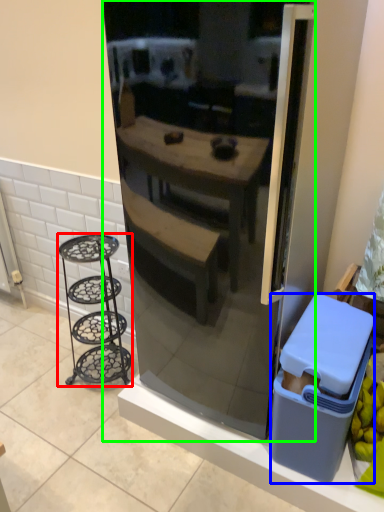
Question: Which object is the farthest from furniture (highlighted by a red box)? Choose among these: trash bin/can (highlighted by a blue box) or refrigerator (highlighted by a green box).

Choices:
 (A) trash bin/can
 (B) refrigerator

Answer: (A)